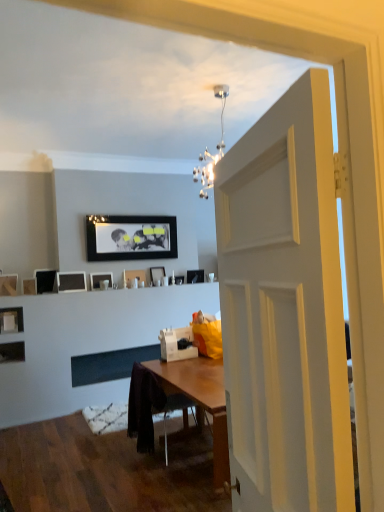
Question: Is matte black picture frame at center, which is the second picture frame in right-to-left order, inside or outside of wooden picture frame at left, which is counted as the 9th picture frame, starting from the right?

Choices:
 (A) inside
 (B) outside

Answer: (B)

Question: From a real-world perspective, relative to wooden picture frame at left, which is counted as the 9th picture frame, starting from the right, is matte black picture frame at center, which is the second picture frame in right-to-left order, vertically above or below?

Choices:
 (A) below
 (B) above

Answer: (A)

Question: Which of these objects is positioned closest to the matte black picture frame at upper center, placed as the fourth picture frame when sorted from right to left?

Choices:
 (A) wooden picture frame at left, the 3th picture frame in the left-to-right sequence
 (B) matte black picture frame at center, placed as the seventh picture frame when sorted from right to left
 (C) matte black picture frame at upper center, the sixth picture frame positioned from the left
 (D) matte black picture frame at left, arranged as the fourth picture frame when viewed from the left
 (E) matte black picture frame at upper center, placed as the eleventh picture frame when sorted from left to right

Answer: (C)

Question: Which object is positioned farthest from the matte black picture frame at center, which is the second picture frame in right-to-left order?

Choices:
 (A) matte black picture frame at upper center, the 8th picture frame when ordered from left to right
 (B) matte black picture frame at upper center, marked as the 6th picture frame in a right-to-left arrangement
 (C) wooden chair at center
 (D) black glossy picture frame at upper center, arranged as the fifth picture frame when viewed from the right
 (E) matte black picture frame at left, marked as the 8th picture frame in a right-to-left arrangement

Answer: (C)